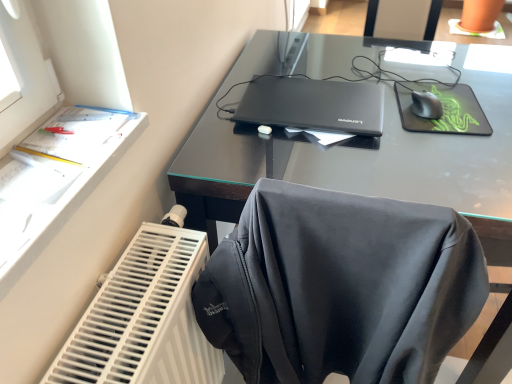
Find the location of `blank area to the left of black matte mouse at upper right`. blank area to the left of black matte mouse at upper right is located at coordinates (383, 112).